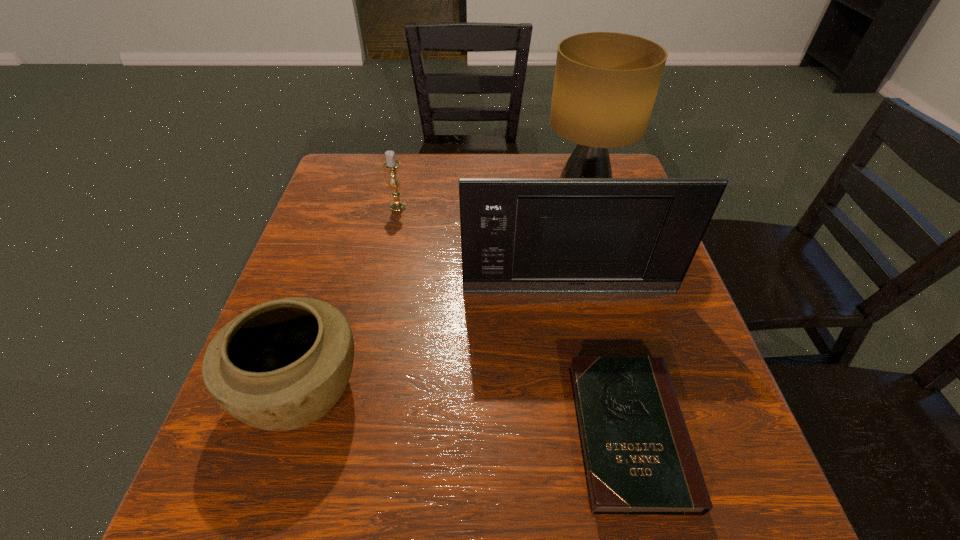
In the image, there is a desktop. At what (x,y) coordinates should I click in order to perform the action: click on vacant space at the near edge. Please return your answer as a coordinate pair (x, y). The width and height of the screenshot is (960, 540). Looking at the image, I should click on (425, 527).

Identify the location of free location at the left edge of the desktop. (368, 222).

This screenshot has width=960, height=540. I want to click on vacant space at the right edge, so click(x=713, y=370).

Locate an element on the screen. Image resolution: width=960 pixels, height=540 pixels. vacant region at the near left corner of the desktop is located at coordinates (221, 520).

Image resolution: width=960 pixels, height=540 pixels. What are the coordinates of `vacant area that lies between the pottery and the microwave oven` in the screenshot? It's located at (435, 339).

This screenshot has width=960, height=540. Find the location of `free space between the shortest object and the pottery`. free space between the shortest object and the pottery is located at coordinates pos(465,410).

The width and height of the screenshot is (960, 540). What are the coordinates of `empty location between the pottery and the tallest object` in the screenshot? It's located at (442, 293).

Locate an element on the screen. vacant space that's between the pottery and the Bible is located at coordinates (465, 410).

Image resolution: width=960 pixels, height=540 pixels. Find the location of `vacant point located between the pottery and the candle holder`. vacant point located between the pottery and the candle holder is located at coordinates (349, 297).

This screenshot has height=540, width=960. Identify the location of free space between the pottery and the candle holder. (349, 297).